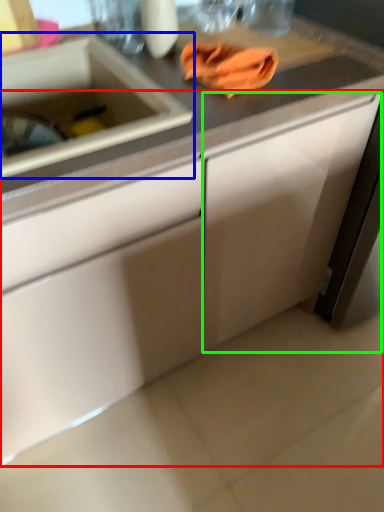
Question: Based on their relative distances, which object is nearer to cabinetry (highlighted by a red box)? Choose from sink (highlighted by a blue box) and cabinetry (highlighted by a green box).

Choices:
 (A) sink
 (B) cabinetry

Answer: (B)